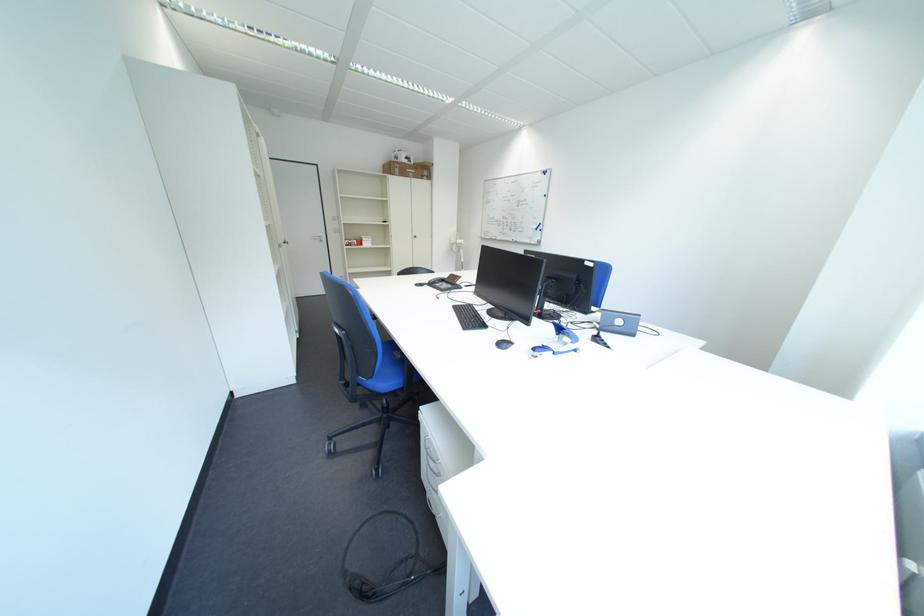
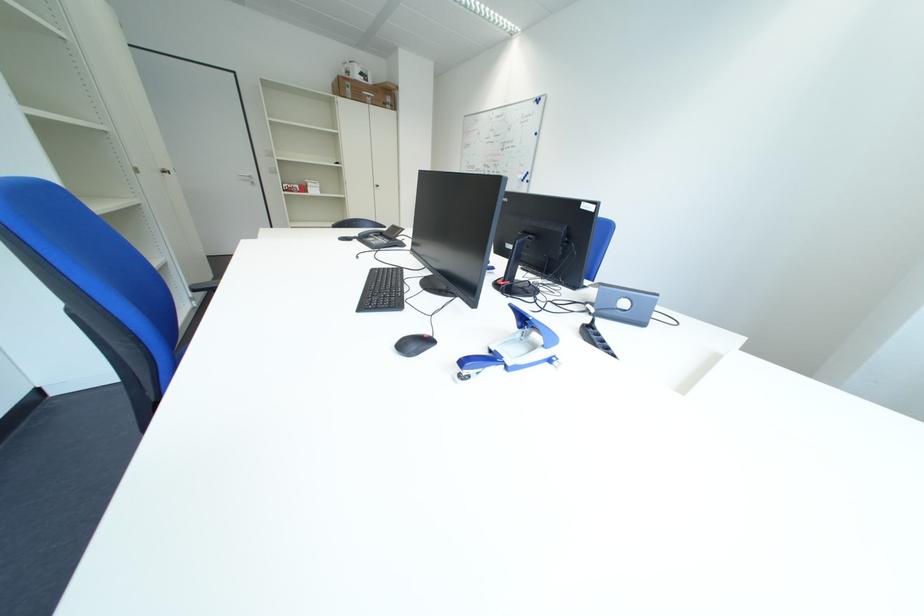
The point at (424, 164) is marked in the first image. Where is the corresponding point in the second image?

(383, 84)